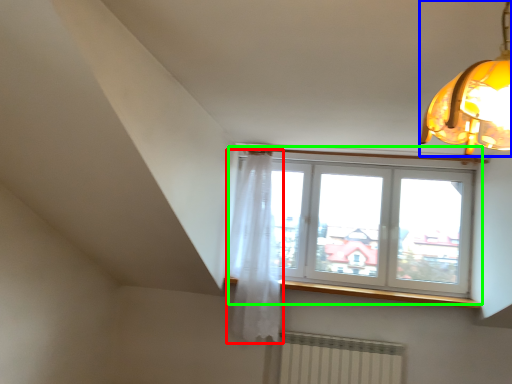
Question: Considering the real-world distances, which object is closest to curtain (highlighted by a red box)? lamp (highlighted by a blue box) or window (highlighted by a green box).

Choices:
 (A) lamp
 (B) window

Answer: (B)